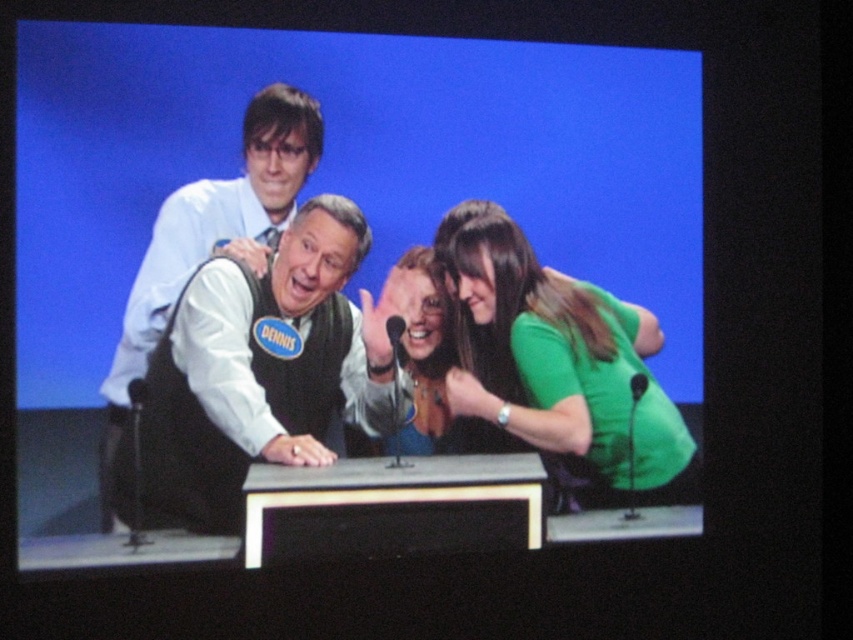
Is matte black podium at center bigger than white shirt at center?

Yes.

Which is behind, point (688, 346) or point (314, 448)?

Positioned behind is point (688, 346).

Is point (518, 48) more distant than point (210, 474)?

Yes, it is.

This screenshot has height=640, width=853. What are the coordinates of `matte black podium at center` in the screenshot? It's located at (314, 193).

Which of these two, white shirt at center or green matte shirt at right, stands shorter?

green matte shirt at right is shorter.

Does point (271, 388) come closer to viewer compared to point (477, 243)?

Yes, it is.

Is point (196, 433) positioned before point (509, 417)?

Yes, point (196, 433) is in front of point (509, 417).

Where is `white shirt at center`? white shirt at center is located at coordinates (260, 371).

Who is positioned more to the right, white shirt at center or matte green dress at center?

From the viewer's perspective, matte green dress at center appears more on the right side.

Does white shirt at center lie in front of matte green dress at center?

Yes, it is in front of matte green dress at center.

Find the location of a particular element. white shirt at center is located at coordinates (260, 371).